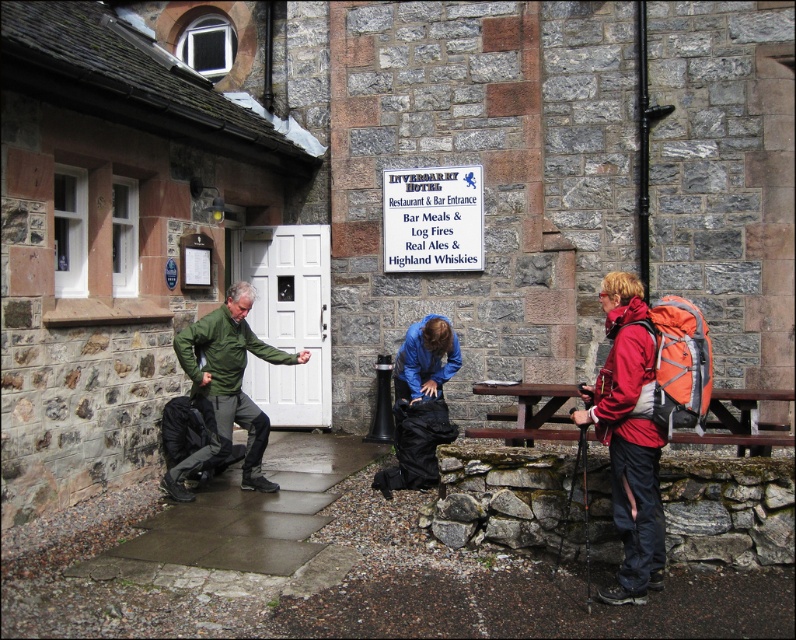
You are a visitor at the Inveraray Hotel and want to place a new coat rack next to the wooden picnic table at center. The coat rack is 1.2 meters wide. Can the matte red jacket at right currently occupying the space fit on the coat rack?

The matte red jacket at right is thinner than the wooden picnic table at center, but the description does not provide specific measurements for the jacket or the coat rack. Therefore, it is unclear if the matte red jacket at right can fit on the 1.2 meter wide coat rack.